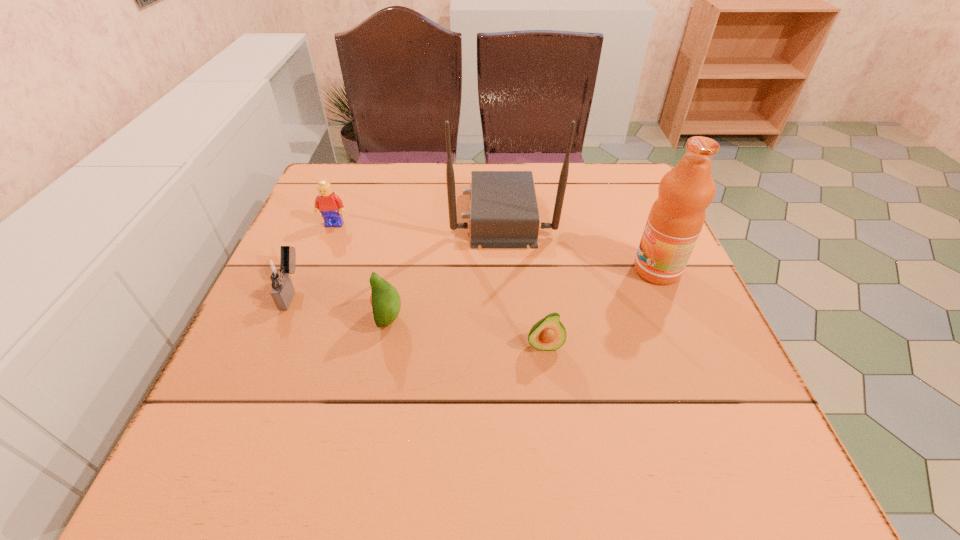
I want to click on free space located 0.130m on the cut side of the nearer avocado, so click(x=554, y=422).

Locate an element on the screen. Image resolution: width=960 pixels, height=540 pixels. free space located on the label side of the rightmost object is located at coordinates (472, 270).

Find the location of a particular element. The width and height of the screenshot is (960, 540). vacant space located 0.280m on the label side of the rightmost object is located at coordinates (505, 270).

Locate an element on the screen. This screenshot has height=540, width=960. vacant space located 0.200m on the label side of the rightmost object is located at coordinates (541, 270).

The height and width of the screenshot is (540, 960). Find the location of `free space located on the front-facing side of the Lego`. free space located on the front-facing side of the Lego is located at coordinates (290, 340).

Find the location of a particular element. Image resolution: width=960 pixels, height=540 pixels. blank space located 0.130m on the back of the router to connect cables is located at coordinates (400, 214).

This screenshot has height=540, width=960. What are the coordinates of `free space located on the back of the router to connect cables` in the screenshot? It's located at (332, 214).

Where is `blank area located 0.300m on the back of the router to connect cables`? blank area located 0.300m on the back of the router to connect cables is located at coordinates (332, 214).

You are a GUI agent. You are given a task and a screenshot of the screen. Output one action in this format:
    pyautogui.click(x=<x>, y=<y>)
    Task: Click on the free spot located on the back of the igniter
    The width and height of the screenshot is (960, 540).
    Given the screenshot: What is the action you would take?
    pyautogui.click(x=316, y=234)

Where is `object that is at the far edge`? The image size is (960, 540). object that is at the far edge is located at coordinates (504, 214).